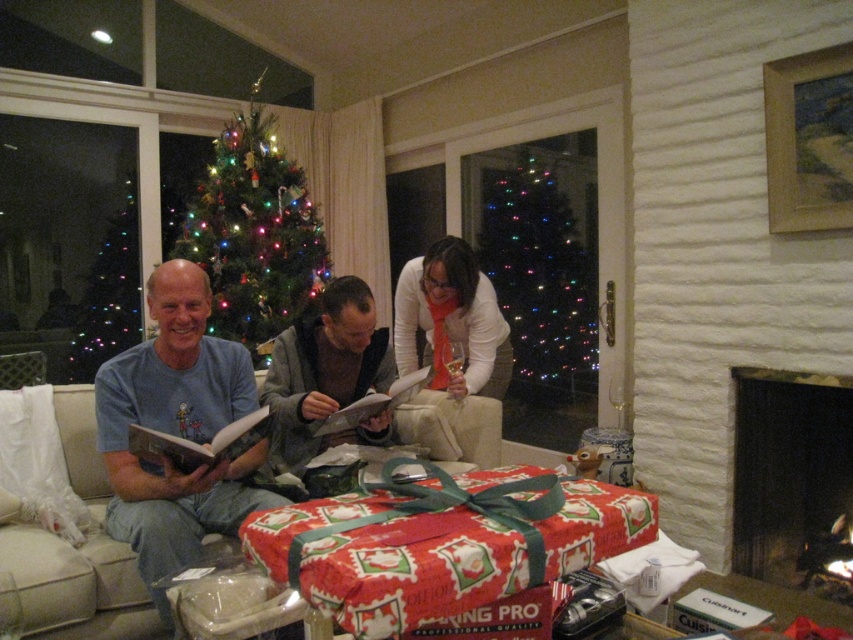
You are a guest at a Christmas party and see the white matte sweater at center and the green glittering christmas tree at upper left. Which object is positioned to the right of the other?

The white matte sweater at center is to the right of the green glittering christmas tree at upper left.